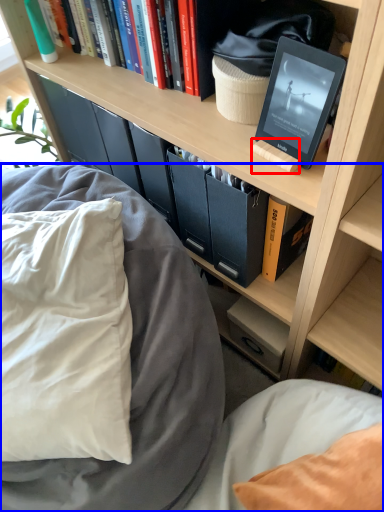
Question: Which object appears farthest to the camera in this image, book (highlighted by a red box) or bed (highlighted by a blue box)?

Choices:
 (A) book
 (B) bed

Answer: (A)